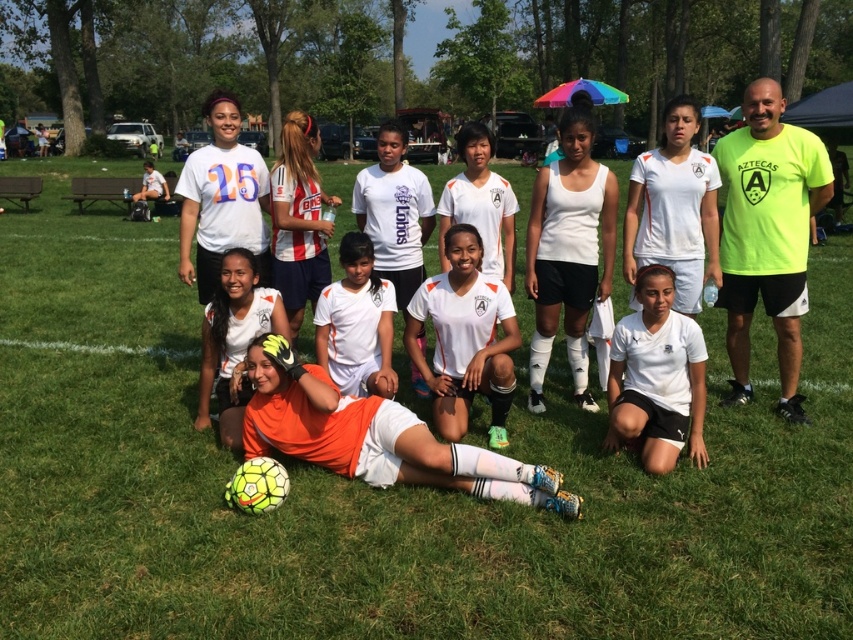
Question: Which point appears farthest from the camera in this image?

Choices:
 (A) (583, 268)
 (B) (325, 356)
 (C) (498, 477)
 (D) (706, 262)

Answer: (A)

Question: Is orange matte soccer ball at center above striped jersey at center?

Choices:
 (A) no
 (B) yes

Answer: (A)

Question: Among these points, which one is farthest from the camera?

Choices:
 (A) (572, 340)
 (B) (294, 189)
 (C) (235, 252)

Answer: (B)

Question: Is orange matte soccer ball at center further to camera compared to white matte soccer jersey at center?

Choices:
 (A) no
 (B) yes

Answer: (A)

Question: Which of the following is the closest to the observer?

Choices:
 (A) striped jersey at center
 (B) orange jersey at center
 (C) white matte tank top at center

Answer: (B)

Question: Can you confirm if orange matte soccer ball at center is wider than white matte soccer jersey at center?

Choices:
 (A) no
 (B) yes

Answer: (B)